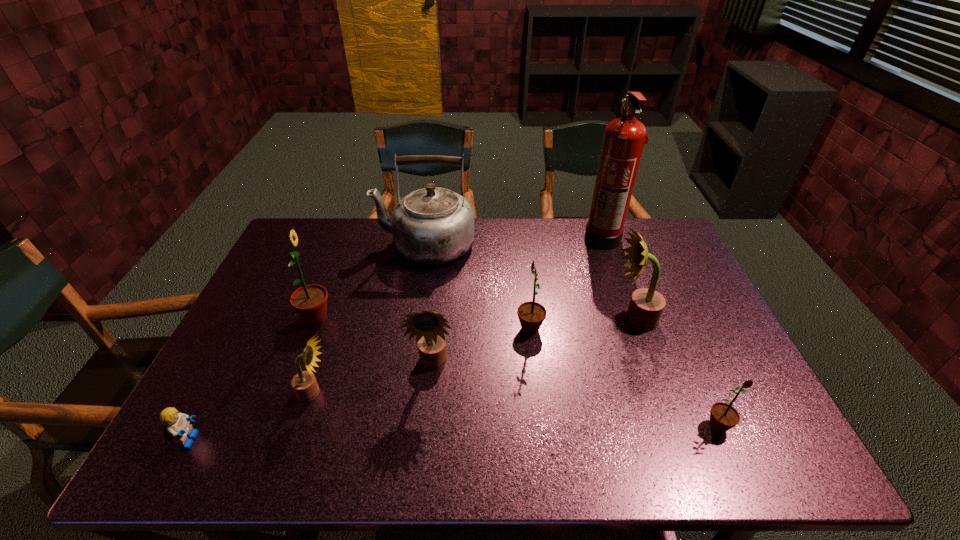
Locate which yellow sunflower ranks second in proximity to the shortest object. Please provide its 2D coordinates. Your answer should be formatted as a tuple, i.e. [(x, y)], where the tuple contains the x and y coordinates of a point satisfying the conditions above.

[(428, 327)]

Find the location of `green sunflower that is the nearest to the smallest green sunflower`. green sunflower that is the nearest to the smallest green sunflower is located at coordinates (531, 315).

You are a GUI agent. You are given a task and a screenshot of the screen. Output one action in this format:
    pyautogui.click(x=<x>, y=<y>)
    Task: Click on the second closest green sunflower relative to the second green sunflower from left to right
    
    Given the screenshot: What is the action you would take?
    pyautogui.click(x=310, y=301)

At what (x,y) coordinates should I click in order to perform the action: click on vacant space that satisfies the following two spatial constraints: 1. on the face of the third sunflower from right to left; 2. on the face of the second yellow sunflower from left to right. Please return your answer as a coordinate pair (x, y). Looking at the image, I should click on (534, 364).